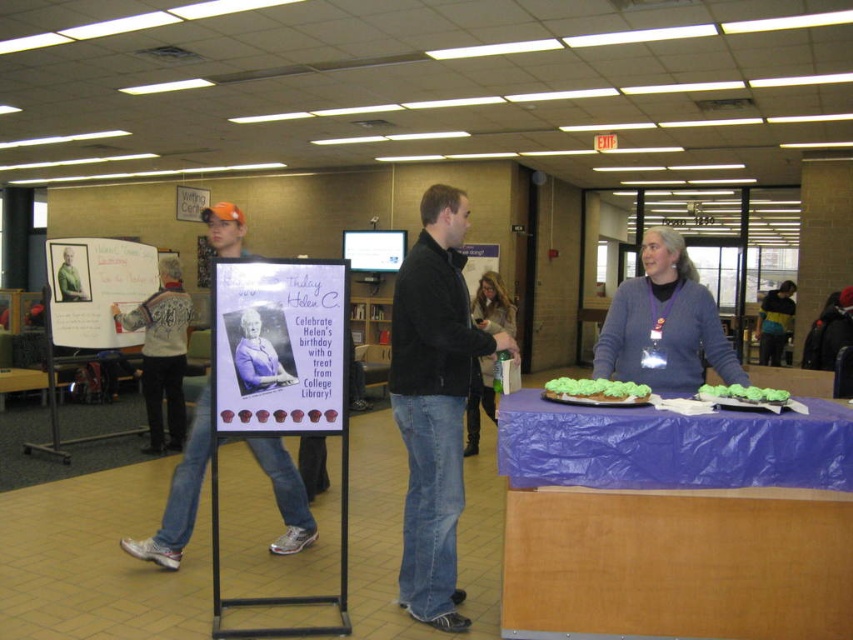
Question: Can you confirm if purple paper poster at center is bigger than green frosted cupcakes at center?

Choices:
 (A) yes
 (B) no

Answer: (A)

Question: Which object is farther from the camera taking this photo?

Choices:
 (A) green frosted cake at center
 (B) denim jeans at center

Answer: (B)

Question: Which point is closer to the camera?

Choices:
 (A) tap(709, 298)
 (B) tap(448, 433)
 (C) tap(57, 275)

Answer: (B)

Question: Which object is positioned farthest from the denim jeans at center?

Choices:
 (A) green plastic cup at center
 (B) purple paper poster at center

Answer: (A)

Question: Where is white paperboard at upper left located in relation to green matte jacket at upper left in the image?

Choices:
 (A) below
 (B) above

Answer: (A)

Question: Does blue fabric table at lower center appear on the right side of green plastic cup at center?

Choices:
 (A) yes
 (B) no

Answer: (A)